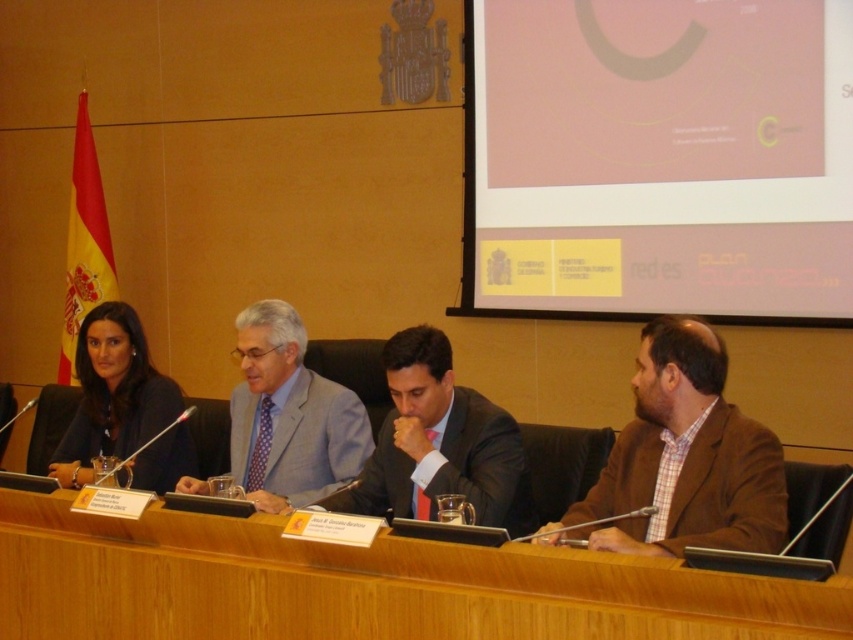
Can you confirm if wooden at center is thinner than brown plaid shirt at right?

No.

This screenshot has width=853, height=640. Describe the element at coordinates (363, 586) in the screenshot. I see `wooden at center` at that location.

Who is more distant from viewer, [428,556] or [782,540]?

The point [782,540] is more distant.

This screenshot has width=853, height=640. I want to click on wooden at center, so click(x=363, y=586).

Looking at this image, does matte gray suit at center have a greater width compared to matte black suit at left?

Correct, the width of matte gray suit at center exceeds that of matte black suit at left.

Between point (363, 420) and point (113, 388), which one is positioned in front?

Positioned in front is point (363, 420).

Between point (303, 381) and point (103, 392), which one is positioned behind?

Point (103, 392)

Where is `matte gray suit at center`? The height and width of the screenshot is (640, 853). matte gray suit at center is located at coordinates (289, 416).

Is wooden at center wider than matte gray suit at center?

Indeed, wooden at center has a greater width compared to matte gray suit at center.

Who is more forward, (546,609) or (270,378)?

Positioned in front is point (546,609).

Image resolution: width=853 pixels, height=640 pixels. Find the location of `wooden at center`. wooden at center is located at coordinates (363, 586).